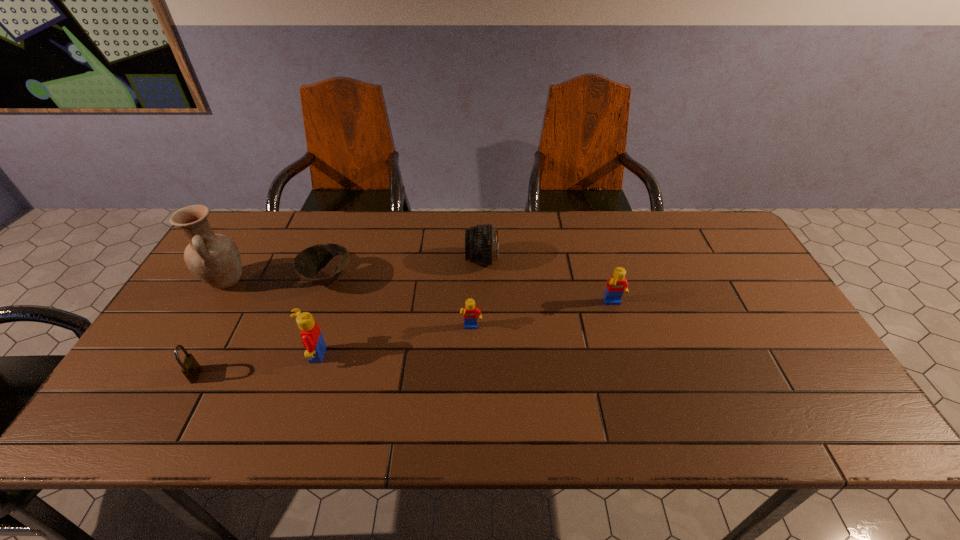
Locate an element on the screen. blank region between the tallest object and the shortest object is located at coordinates (276, 280).

This screenshot has height=540, width=960. Find the location of `free spot between the second Lego from right to left and the rightmost Lego`. free spot between the second Lego from right to left and the rightmost Lego is located at coordinates (542, 316).

Locate an element on the screen. Image resolution: width=960 pixels, height=540 pixels. blank region between the shortest Lego and the tallest Lego is located at coordinates (393, 342).

This screenshot has width=960, height=540. I want to click on empty space that is in between the fifth farthest object and the telephoto lens, so [476, 294].

Where is `vacant area between the padlock and the bowl`? Image resolution: width=960 pixels, height=540 pixels. vacant area between the padlock and the bowl is located at coordinates (262, 327).

Where is `object that is the second closest to the second shortest Lego`? object that is the second closest to the second shortest Lego is located at coordinates (470, 312).

Locate which object is the closest to the padlock. Please provide its 2D coordinates. Your answer should be formatted as a tuple, i.e. [(x, y)], where the tuple contains the x and y coordinates of a point satisfying the conditions above.

[(311, 335)]

Where is `Lego identified as the closest to the padlock`? This screenshot has width=960, height=540. Lego identified as the closest to the padlock is located at coordinates (311, 335).

Find the location of a particular element. the second closest Lego to the leftmost Lego is located at coordinates (617, 284).

I want to click on free spot that satisfies the following two spatial constraints: 1. on the face of the rightmost Lego; 2. on the face of the leftmost Lego, so click(628, 355).